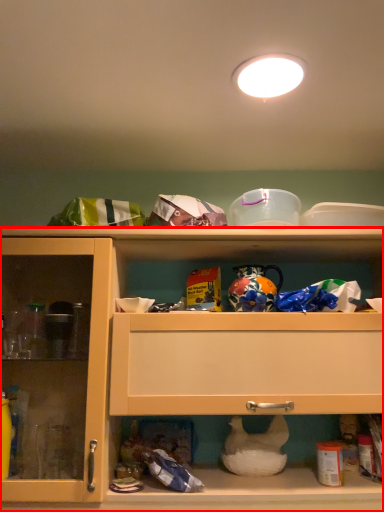
Question: From the image's perspective, what is the correct spatial positioning of cabinetry (annotated by the red box) in reference to lighting?

Choices:
 (A) above
 (B) below

Answer: (B)